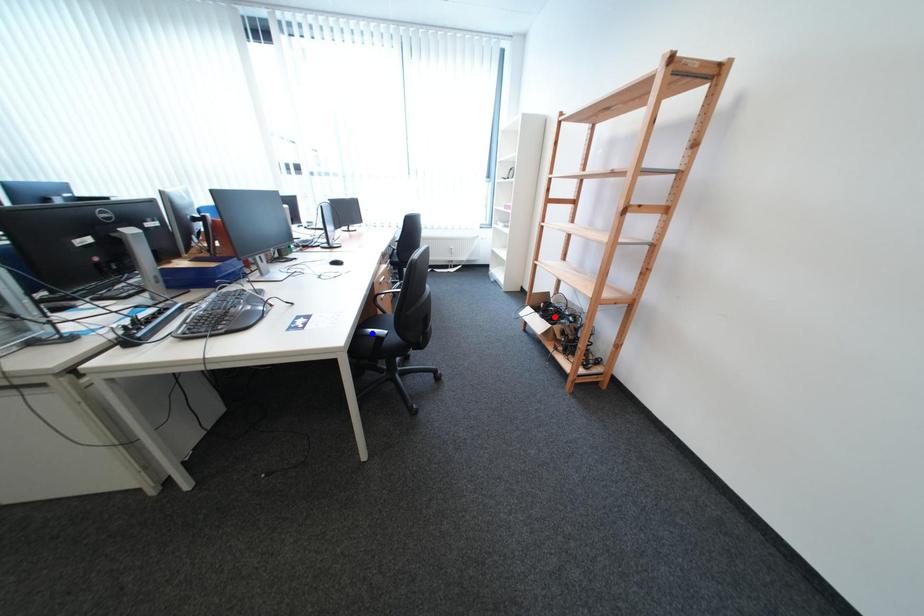
Question: Which of the two points in the image is closer to the camera?

Choices:
 (A) Blue point is closer.
 (B) Red point is closer.

Answer: (A)